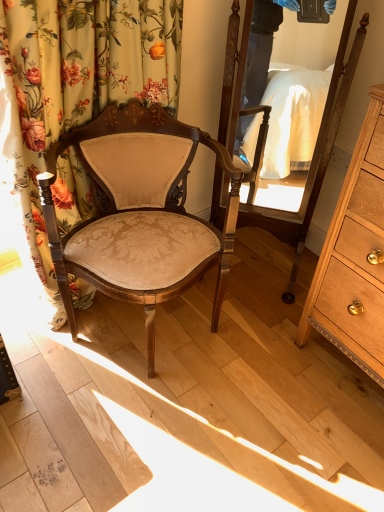
What are the coordinates of `vacant area situated below wooden mirror at center (from a real-world perspective)` in the screenshot? It's located at (262, 271).